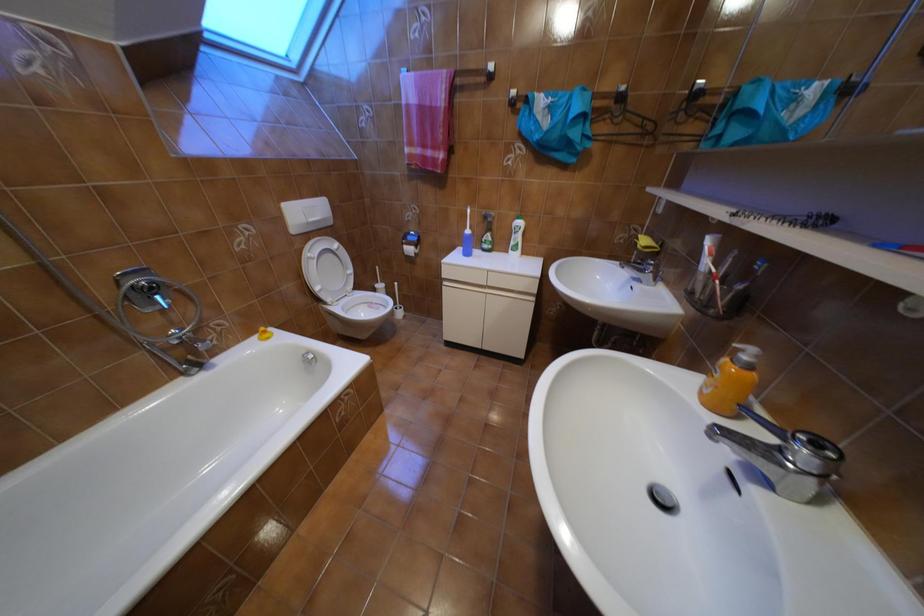
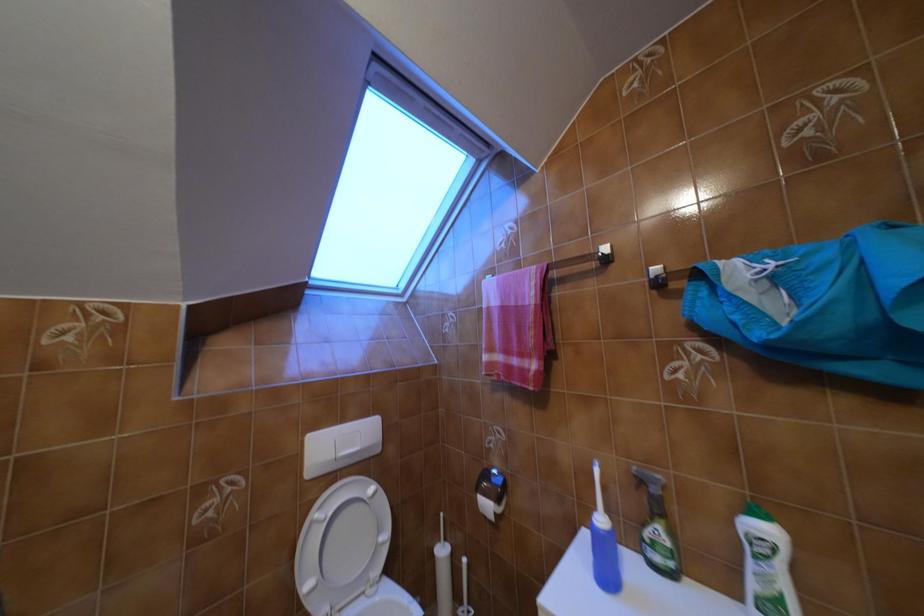
How did the camera likely rotate?

The rotation direction of the camera is left-up.